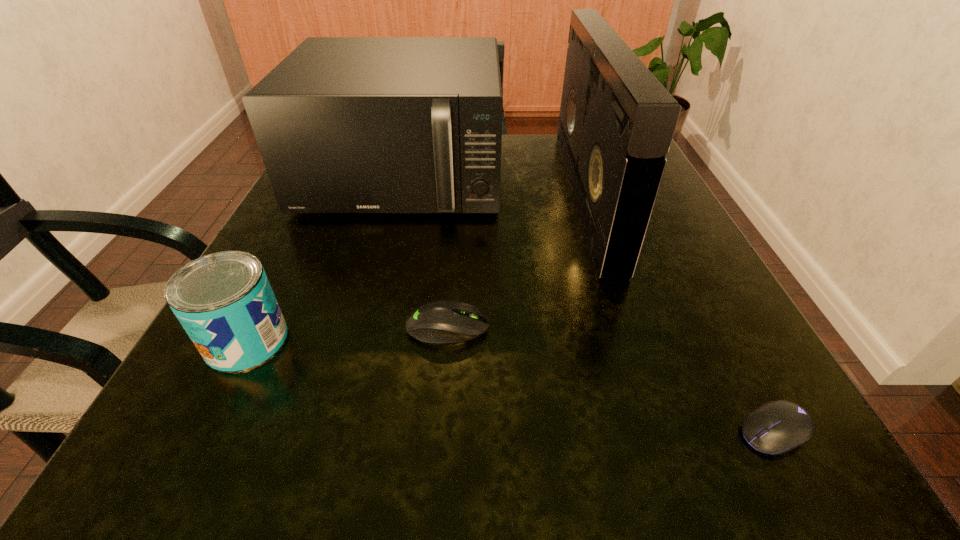
Locate an element on the screen. This screenshot has height=540, width=960. free space between the shorter computer mouse and the can is located at coordinates (510, 386).

Locate an element on the screen. The image size is (960, 540). free point between the tallest object and the right computer mouse is located at coordinates (680, 313).

Image resolution: width=960 pixels, height=540 pixels. I want to click on empty space that is in between the shorter computer mouse and the third tallest object, so click(510, 386).

Image resolution: width=960 pixels, height=540 pixels. Identify the location of free space between the can and the second tallest object. [x=324, y=259].

Identify the location of vacant area that lies between the taller computer mouse and the right computer mouse. (611, 379).

The image size is (960, 540). In order to click on empty space between the farther computer mouse and the fourth object from left to right in this screenshot , I will do point(516,261).

Image resolution: width=960 pixels, height=540 pixels. Find the location of `blank region between the tallest object and the right computer mouse`. blank region between the tallest object and the right computer mouse is located at coordinates (680, 313).

Locate an element on the screen. This screenshot has height=540, width=960. free space between the right computer mouse and the videotape is located at coordinates (680, 313).

Choose which object is the second nearest neighbor to the fourth shortest object. Please provide its 2D coordinates. Your answer should be formatted as a tuple, i.e. [(x, y)], where the tuple contains the x and y coordinates of a point satisfying the conditions above.

[(438, 322)]

Locate which object ranks second in proximity to the third tallest object. Please provide its 2D coordinates. Your answer should be formatted as a tuple, i.e. [(x, y)], where the tuple contains the x and y coordinates of a point satisfying the conditions above.

[(344, 124)]